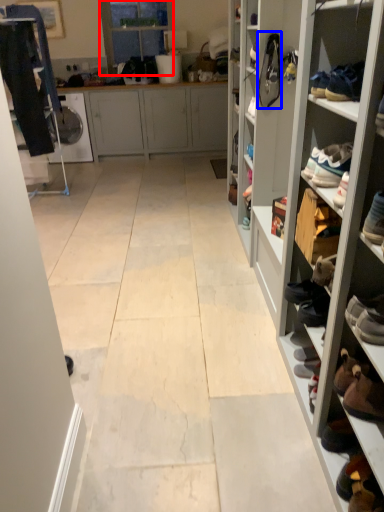
Question: Which object appears farthest to the camera in this image, glass door (highlighted by a red box) or shoe (highlighted by a blue box)?

Choices:
 (A) glass door
 (B) shoe

Answer: (A)